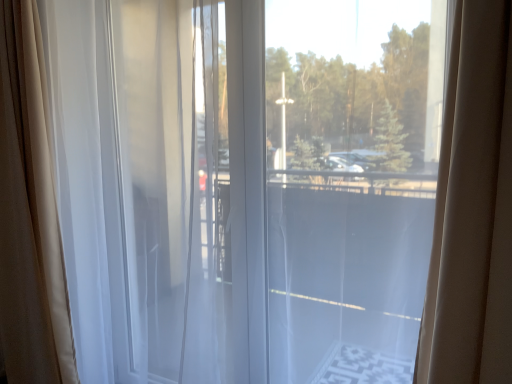
Question: From the image's perspective, is sheer white curtain at left, arranged as the 2th curtain when viewed from the right, on transparent glass window at center?

Choices:
 (A) yes
 (B) no

Answer: (B)

Question: Is sheer white curtain at left, arranged as the 2th curtain when viewed from the right, shorter than transparent glass window at center?

Choices:
 (A) yes
 (B) no

Answer: (B)

Question: Is sheer white curtain at left, which ranks as the 1th curtain in left-to-right order, positioned far away from transparent glass window at center?

Choices:
 (A) no
 (B) yes

Answer: (B)

Question: Can you confirm if sheer white curtain at left, arranged as the 2th curtain when viewed from the right, is smaller than transparent glass window at center?

Choices:
 (A) no
 (B) yes

Answer: (B)

Question: Does sheer white curtain at left, which ranks as the 1th curtain in left-to-right order, come behind transparent glass window at center?

Choices:
 (A) yes
 (B) no

Answer: (A)

Question: Could you tell me if sheer white curtain at left, arranged as the 2th curtain when viewed from the right, is facing transparent glass window at center?

Choices:
 (A) yes
 (B) no

Answer: (B)

Question: Is transparent glass window at center oriented away from sheer white curtain at left, arranged as the 2th curtain when viewed from the right?

Choices:
 (A) no
 (B) yes

Answer: (A)

Question: Is the depth of transparent glass window at center greater than that of sheer white curtain at left, arranged as the 2th curtain when viewed from the right?

Choices:
 (A) no
 (B) yes

Answer: (A)

Question: Is transparent glass window at center aimed at sheer white curtain at left, arranged as the 2th curtain when viewed from the right?

Choices:
 (A) yes
 (B) no

Answer: (B)

Question: Does transparent glass window at center have a lesser height compared to sheer white curtain at left, which ranks as the 1th curtain in left-to-right order?

Choices:
 (A) no
 (B) yes

Answer: (B)

Question: Does transparent glass window at center have a greater height compared to sheer white curtain at left, which ranks as the 1th curtain in left-to-right order?

Choices:
 (A) no
 (B) yes

Answer: (A)

Question: Is transparent glass window at center completely or partially outside of sheer white curtain at left, arranged as the 2th curtain when viewed from the right?

Choices:
 (A) yes
 (B) no

Answer: (A)

Question: Is white sheer curtain at left, which appears as the first curtain when viewed from the right, further to camera compared to sheer white curtain at left, which ranks as the 1th curtain in left-to-right order?

Choices:
 (A) no
 (B) yes

Answer: (A)